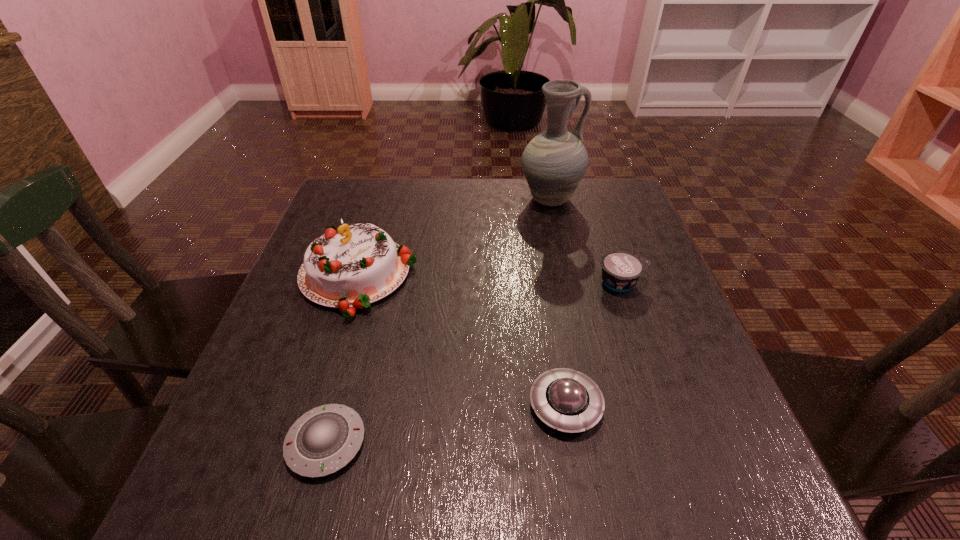
Identify the location of vacant area located 0.380m on the front of the yogurt. The width and height of the screenshot is (960, 540). (689, 476).

Find the location of a particular element. The height and width of the screenshot is (540, 960). free location located 0.150m on the back of the shortest object is located at coordinates (354, 340).

I want to click on object that is at the far edge, so click(554, 162).

Where is `object that is at the near edge`? This screenshot has height=540, width=960. object that is at the near edge is located at coordinates (325, 439).

Identify the location of cake that is at the left edge. (351, 267).

Image resolution: width=960 pixels, height=540 pixels. Find the location of `saucer positioned at the left edge`. saucer positioned at the left edge is located at coordinates (325, 439).

The width and height of the screenshot is (960, 540). Find the location of `pitcher located in the right edge section of the desktop`. pitcher located in the right edge section of the desktop is located at coordinates (554, 162).

Identify the location of yogurt located at the right edge. The width and height of the screenshot is (960, 540). (621, 270).

Where is `object located in the near left corner section of the desktop`? The width and height of the screenshot is (960, 540). object located in the near left corner section of the desktop is located at coordinates (325, 439).

Image resolution: width=960 pixels, height=540 pixels. What are the coordinates of `object that is at the far right corner` in the screenshot? It's located at (554, 162).